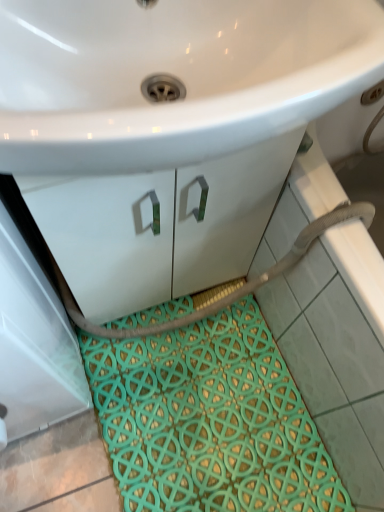
This screenshot has width=384, height=512. Describe the element at coordinates (209, 420) in the screenshot. I see `teal woven bath mat at lower center` at that location.

Locate an element on the screen. This screenshot has width=384, height=512. teal woven bath mat at lower center is located at coordinates (209, 420).

In order to face teal woven bath mat at lower center, should I rotate leftwards or rightwards?

You should look right and rotate roughly 2.122 degrees.

Image resolution: width=384 pixels, height=512 pixels. Describe the element at coordinates (172, 75) in the screenshot. I see `white glossy sink at upper center` at that location.

Identify the location of white glossy sink at upper center. This screenshot has height=512, width=384. (172, 75).

Measure the distance between white glossy sink at upper center and camera.

The distance of white glossy sink at upper center from camera is 14.80 inches.

In order to face white glossy sink at upper center, should I rotate leftwards or rightwards?

You should rotate left by 3.432 degrees.

Where is `teal woven bath mat at lower center`? Image resolution: width=384 pixels, height=512 pixels. teal woven bath mat at lower center is located at coordinates (209, 420).

Which object is positioned more to the left, teal woven bath mat at lower center or white glossy sink at upper center?

white glossy sink at upper center is more to the left.

Considering their positions, is teal woven bath mat at lower center located in front of or behind white glossy sink at upper center?

Visually, teal woven bath mat at lower center is located behind white glossy sink at upper center.

Considering the positions of points (159, 386) and (148, 142), is point (159, 386) farther from camera compared to point (148, 142)?

Yes, point (159, 386) is behind point (148, 142).

From the image's perspective, is teal woven bath mat at lower center located beneath white glossy sink at upper center?

Indeed, from the image's perspective, teal woven bath mat at lower center is shown beneath white glossy sink at upper center.

From a real-world perspective, is teal woven bath mat at lower center physically above white glossy sink at upper center?

Actually, teal woven bath mat at lower center is physically below white glossy sink at upper center in the real world.

Does teal woven bath mat at lower center have a lesser width compared to white glossy sink at upper center?

No.

Does teal woven bath mat at lower center have a greater height compared to white glossy sink at upper center?

No, teal woven bath mat at lower center is not taller than white glossy sink at upper center.

Is teal woven bath mat at lower center bigger or smaller than white glossy sink at upper center?

Considering their sizes, teal woven bath mat at lower center takes up less space than white glossy sink at upper center.

Do you think teal woven bath mat at lower center is within white glossy sink at upper center, or outside of it?

teal woven bath mat at lower center is spatially situated outside white glossy sink at upper center.

Is teal woven bath mat at lower center next to white glossy sink at upper center?

There is a gap between teal woven bath mat at lower center and white glossy sink at upper center.

Is teal woven bath mat at lower center aimed at white glossy sink at upper center?

No, teal woven bath mat at lower center is not turned towards white glossy sink at upper center.

Measure the distance between teal woven bath mat at lower center and white glossy sink at upper center.

28.37 inches.

Locate an element on the screen. bath mat that is below the white glossy sink at upper center (from the image's perspective) is located at coordinates (209, 420).

Considering the positions of objects white glossy sink at upper center and teal woven bath mat at lower center in the image provided, who is more to the left, white glossy sink at upper center or teal woven bath mat at lower center?

Positioned to the left is white glossy sink at upper center.

In the image, is white glossy sink at upper center positioned in front of or behind teal woven bath mat at lower center?

Clearly, white glossy sink at upper center is in front of teal woven bath mat at lower center.

Considering the points (133, 64) and (149, 472), which point is behind, point (133, 64) or point (149, 472)?

Point (149, 472)

From the image's perspective, is white glossy sink at upper center above or below teal woven bath mat at lower center?

From the image's perspective, white glossy sink at upper center appears above teal woven bath mat at lower center.

From a real-world perspective, between white glossy sink at upper center and teal woven bath mat at lower center, who is vertically higher?

From a 3D spatial view, white glossy sink at upper center is above.

Can you confirm if white glossy sink at upper center is thinner than teal woven bath mat at lower center?

Correct, the width of white glossy sink at upper center is less than that of teal woven bath mat at lower center.

In terms of height, does white glossy sink at upper center look taller or shorter compared to teal woven bath mat at lower center?

In the image, white glossy sink at upper center appears to be taller than teal woven bath mat at lower center.

Is white glossy sink at upper center bigger than teal woven bath mat at lower center?

Correct, white glossy sink at upper center is larger in size than teal woven bath mat at lower center.

Is white glossy sink at upper center inside or outside of teal woven bath mat at lower center?

white glossy sink at upper center cannot be found inside teal woven bath mat at lower center.

From the picture: Are white glossy sink at upper center and teal woven bath mat at lower center located far from each other?

No.

Is white glossy sink at upper center oriented away from teal woven bath mat at lower center?

No, white glossy sink at upper center is not facing away from teal woven bath mat at lower center.

I want to click on bath mat beneath the white glossy sink at upper center (from a real-world perspective), so click(209, 420).

Where is `bath mat that is below the white glossy sink at upper center (from the image's perspective)`? bath mat that is below the white glossy sink at upper center (from the image's perspective) is located at coordinates (209, 420).

I want to click on bath mat behind the white glossy sink at upper center, so (209, 420).